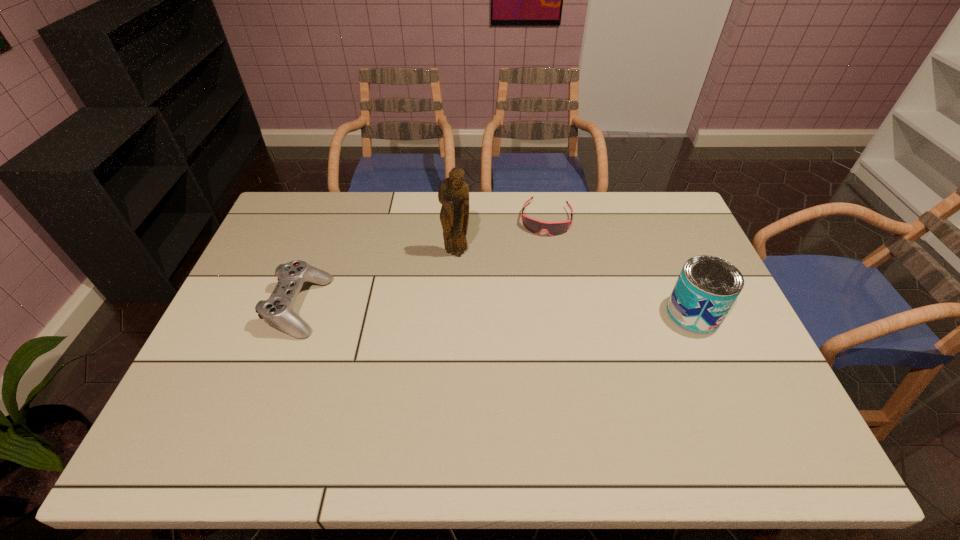
I want to click on vacant space at the near edge, so click(314, 388).

You are a GUI agent. You are given a task and a screenshot of the screen. Output one action in this format:
    pyautogui.click(x=<x>, y=<y>)
    Task: Click on the vacant region at the left edge of the desktop
    This screenshot has width=960, height=540.
    Given the screenshot: What is the action you would take?
    pyautogui.click(x=262, y=365)

In the image, there is a desktop. Where is `vacant space at the right edge`? vacant space at the right edge is located at coordinates (719, 358).

The image size is (960, 540). In the image, there is a desktop. Find the location of `vacant space at the far left corner`. vacant space at the far left corner is located at coordinates (315, 214).

This screenshot has height=540, width=960. In the image, there is a desktop. In order to click on vacant space at the near left corner in this screenshot , I will do `click(212, 409)`.

Identify the location of vacant point at the far right corner. pyautogui.click(x=659, y=215).

Locate an element on the screen. The image size is (960, 540). empty space between the goggles and the third shortest object is located at coordinates (620, 266).

Where is `vacant area that lies between the figurine and the can`? The height and width of the screenshot is (540, 960). vacant area that lies between the figurine and the can is located at coordinates (575, 284).

Locate an element on the screen. This screenshot has height=540, width=960. vacant space in between the goggles and the second object from left to right is located at coordinates (501, 237).

The height and width of the screenshot is (540, 960). Find the location of `unoccupied area between the second object from right to left and the control`. unoccupied area between the second object from right to left and the control is located at coordinates (422, 263).